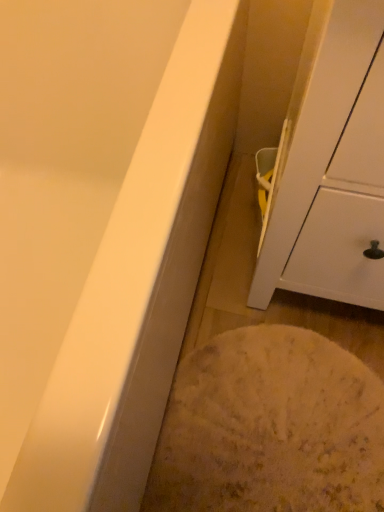
Question: Does white textured rug at lower center have a greater height compared to white matte cabinet at right?

Choices:
 (A) yes
 (B) no

Answer: (B)

Question: Is white textured rug at lower center outside of white matte cabinet at right?

Choices:
 (A) no
 (B) yes

Answer: (B)

Question: Does white textured rug at lower center have a lesser height compared to white matte cabinet at right?

Choices:
 (A) yes
 (B) no

Answer: (A)

Question: From a real-world perspective, does white textured rug at lower center stand above white matte cabinet at right?

Choices:
 (A) no
 (B) yes

Answer: (A)

Question: Considering the relative positions of white textured rug at lower center and white matte cabinet at right in the image provided, is white textured rug at lower center to the right of white matte cabinet at right from the viewer's perspective?

Choices:
 (A) yes
 (B) no

Answer: (B)

Question: From a real-world perspective, is white textured rug at lower center positioned under white matte cabinet at right based on gravity?

Choices:
 (A) yes
 (B) no

Answer: (A)

Question: From a real-world perspective, is white matte cabinet at right on white textured rug at lower center?

Choices:
 (A) no
 (B) yes

Answer: (B)

Question: Are white matte cabinet at right and white textured rug at lower center making contact?

Choices:
 (A) yes
 (B) no

Answer: (B)

Question: Does white matte cabinet at right have a greater width compared to white textured rug at lower center?

Choices:
 (A) yes
 (B) no

Answer: (A)

Question: Does white matte cabinet at right have a smaller size compared to white textured rug at lower center?

Choices:
 (A) no
 (B) yes

Answer: (A)

Question: From a real-world perspective, is white matte cabinet at right below white textured rug at lower center?

Choices:
 (A) no
 (B) yes

Answer: (A)

Question: Is white matte cabinet at right positioned before white textured rug at lower center?

Choices:
 (A) no
 (B) yes

Answer: (B)

Question: Is point (370, 413) positioned closer to the camera than point (357, 17)?

Choices:
 (A) closer
 (B) farther

Answer: (B)